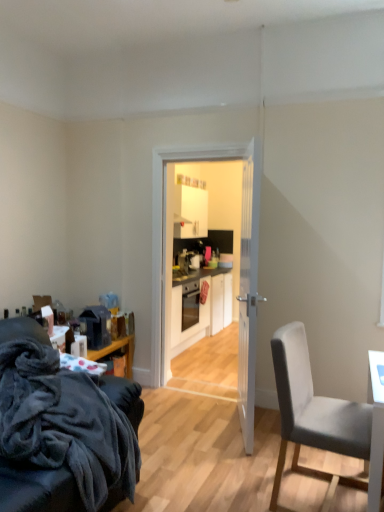
Question: Would you say matte black oven at center is to the left or to the right of velvety dark gray couch at lower left, which appears as the 2th chair when viewed from the right, in the picture?

Choices:
 (A) right
 (B) left

Answer: (A)

Question: From their relative heights in the image, would you say matte black oven at center is taller or shorter than velvety dark gray couch at lower left, arranged as the first chair when viewed from the left?

Choices:
 (A) tall
 (B) short

Answer: (B)

Question: Which object is positioned closest to the gray fabric chair at right, placed as the first chair when sorted from right to left?

Choices:
 (A) white glossy door at center
 (B) matte black oven at center
 (C) white wooden door at center
 (D) white matte cabinet at center
 (E) velvety dark gray couch at lower left, arranged as the first chair when viewed from the left

Answer: (C)

Question: Which object is the closest to the white matte cabinet at center?

Choices:
 (A) white wooden door at center
 (B) white glossy door at center
 (C) velvety dark gray couch at lower left, which appears as the 2th chair when viewed from the right
 (D) matte black oven at center
 (E) gray fabric chair at right, placed as the first chair when sorted from right to left

Answer: (D)